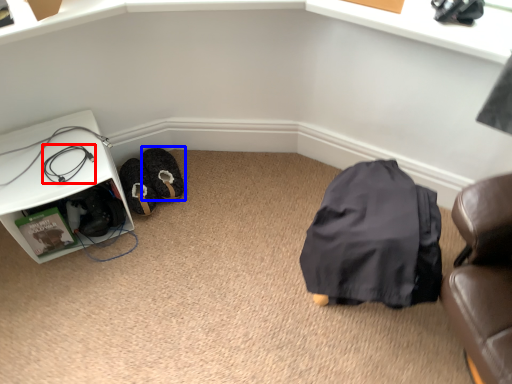
Question: Among these objects, which one is nearest to the camera, wire (highlighted by a red box) or footwear (highlighted by a blue box)?

Choices:
 (A) wire
 (B) footwear

Answer: (A)